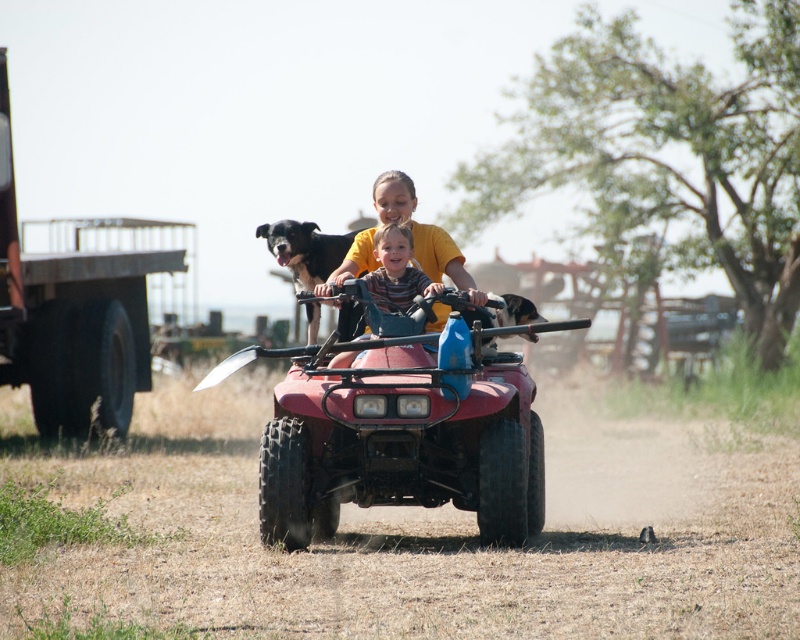
Question: Among these objects, which one is farthest from the camera?

Choices:
 (A) striped fabric shirt at center
 (B) dusty terrain at center
 (C) black fur dog at upper center
 (D) yellow cotton shirt at center

Answer: (D)

Question: Does dusty terrain at center have a greater width compared to black fur dog at upper center?

Choices:
 (A) no
 (B) yes

Answer: (B)

Question: Does dusty terrain at center have a lesser width compared to yellow cotton shirt at center?

Choices:
 (A) no
 (B) yes

Answer: (A)

Question: Which point is farther to the camera?

Choices:
 (A) dusty terrain at center
 (B) striped fabric shirt at center

Answer: (B)

Question: Does dusty terrain at center appear on the right side of striped fabric shirt at center?

Choices:
 (A) yes
 (B) no

Answer: (B)

Question: Which point appears closest to the camera in this image?

Choices:
 (A) (284, 241)
 (B) (444, 310)

Answer: (B)